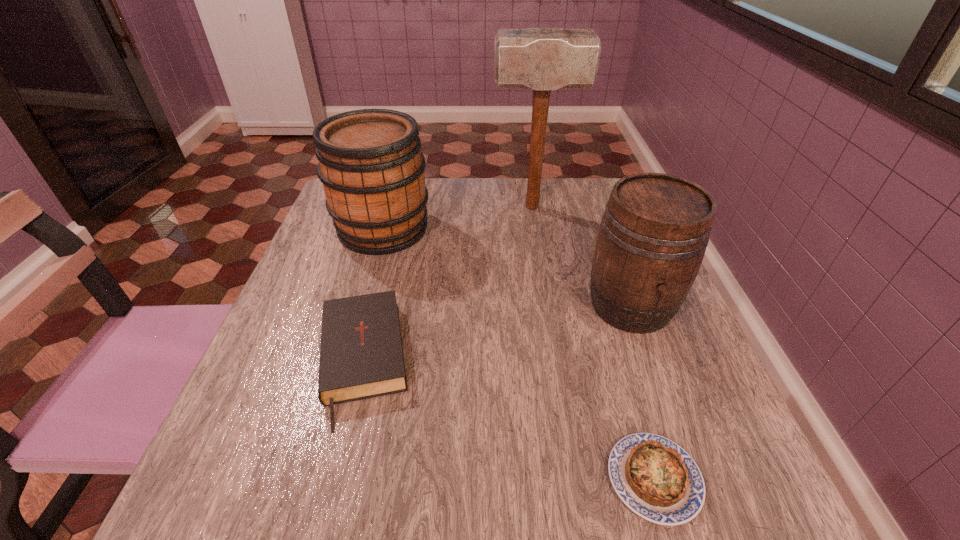
Where is `free region located on the side of the right cider near the bung hole`? This screenshot has height=540, width=960. free region located on the side of the right cider near the bung hole is located at coordinates (704, 503).

At what (x,y) coordinates should I click in order to perform the action: click on vacant area situated on the right of the fourth tallest object. Please return your answer as a coordinate pair (x, y). Looking at the image, I should click on (497, 361).

Find the location of a particular element. free region located 0.390m on the back of the nearest object is located at coordinates (592, 272).

Locate an element on the screen. This screenshot has height=540, width=960. mallet situated at the far edge is located at coordinates (540, 59).

The height and width of the screenshot is (540, 960). I want to click on cider at the far edge, so click(x=370, y=163).

You are a GUI agent. You are given a task and a screenshot of the screen. Output one action in this format:
    pyautogui.click(x=<x>, y=<y>)
    Task: Click on the object that is at the near edge
    The height and width of the screenshot is (540, 960).
    Given the screenshot: What is the action you would take?
    pyautogui.click(x=657, y=479)

The height and width of the screenshot is (540, 960). What are the coordinates of `cider positioned at the left edge` in the screenshot? It's located at (370, 163).

The width and height of the screenshot is (960, 540). What are the coordinates of `Bible positioned at the left edge` in the screenshot? It's located at (361, 356).

Locate an element on the screen. The width and height of the screenshot is (960, 540). mallet located in the right edge section of the desktop is located at coordinates (540, 59).

In order to click on cider that is at the right edge in this screenshot , I will do `click(652, 238)`.